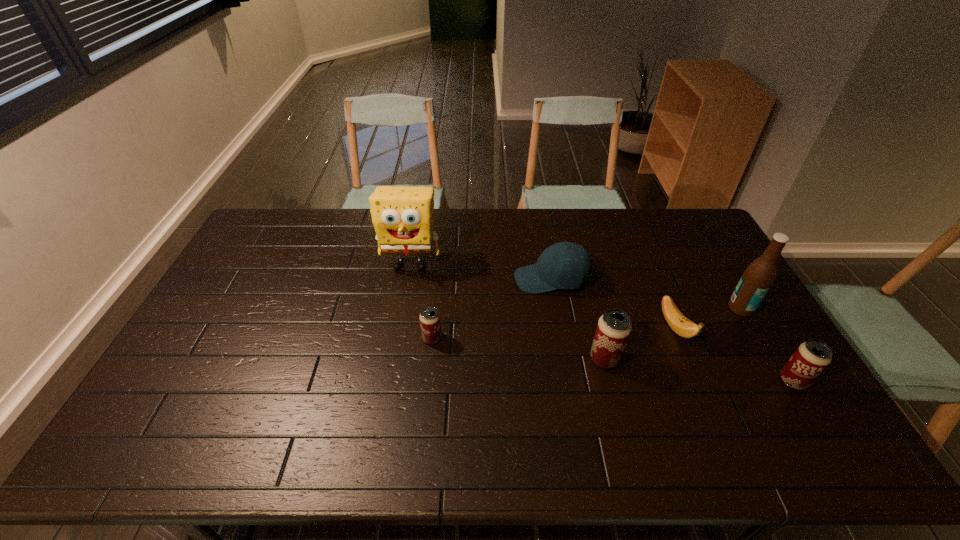
Please point out where to position a new beer can on the left to maintain spacing. Please provide its 2D coordinates. Your answer should be formatted as a tuple, i.e. [(x, y)], where the tuple contains the x and y coordinates of a point satisfying the conditions above.

[(273, 320)]